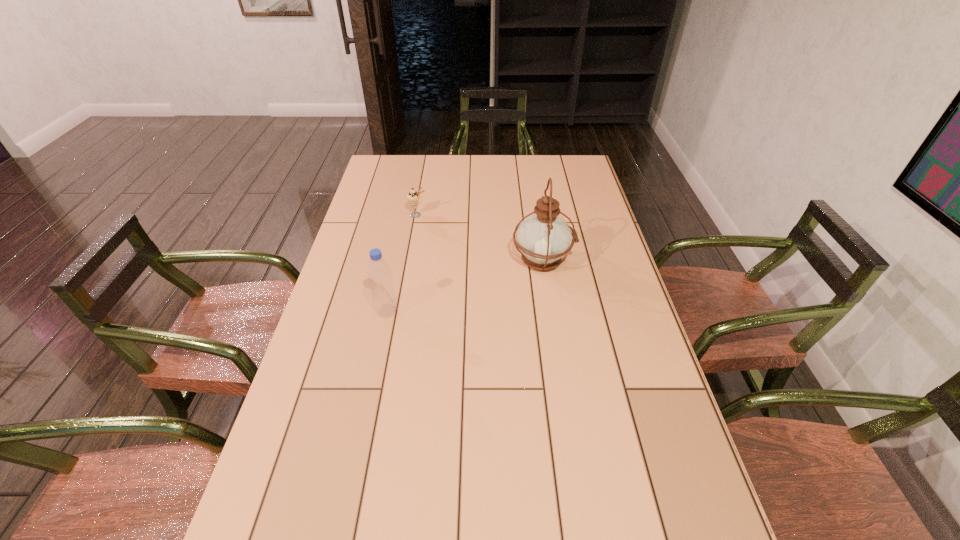
Identify which object is the second nearest to the second farthest object. Please provide its 2D coordinates. Your answer should be formatted as a tuple, i.e. [(x, y)], where the tuple contains the x and y coordinates of a point satisfying the conditions above.

[(379, 274)]